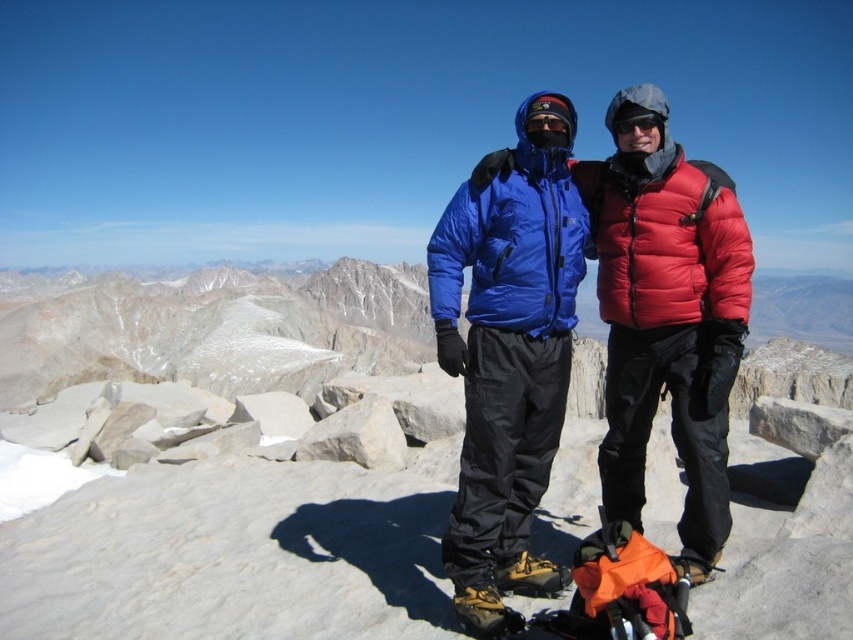
Based on the photo, can you confirm if matte blue jacket at center is positioned to the left of black matte goggles at center?

No, matte blue jacket at center is not to the left of black matte goggles at center.

Based on the photo, can you confirm if matte blue jacket at center is positioned to the right of black matte goggles at center?

Correct, you'll find matte blue jacket at center to the right of black matte goggles at center.

Which is in front, point (642, 243) or point (624, 108)?

Point (642, 243) is in front.

Where is `matte blue jacket at center`? matte blue jacket at center is located at coordinates (666, 317).